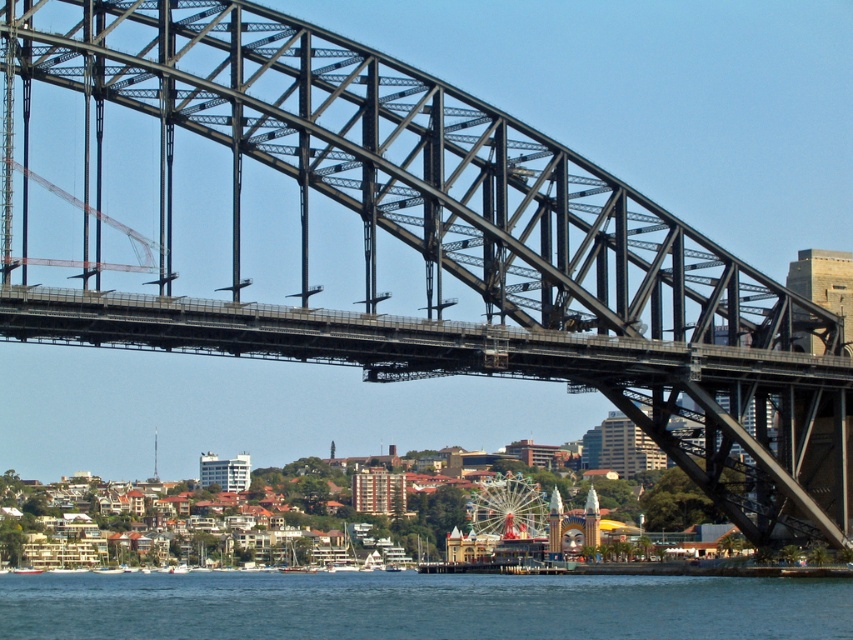
Question: Which point is closer to the camera?

Choices:
 (A) (347, 579)
 (B) (498, 522)

Answer: (B)

Question: Is the position of blue water at lower center more distant than that of metallic ferris wheel at center?

Choices:
 (A) yes
 (B) no

Answer: (B)

Question: Among these points, which one is farthest from the camera?

Choices:
 (A) (712, 592)
 (B) (462, 499)

Answer: (B)

Question: Can you confirm if blue water at lower center is positioned to the right of metallic ferris wheel at center?

Choices:
 (A) yes
 (B) no

Answer: (B)

Question: Does blue water at lower center appear on the left side of metallic ferris wheel at center?

Choices:
 (A) no
 (B) yes

Answer: (B)